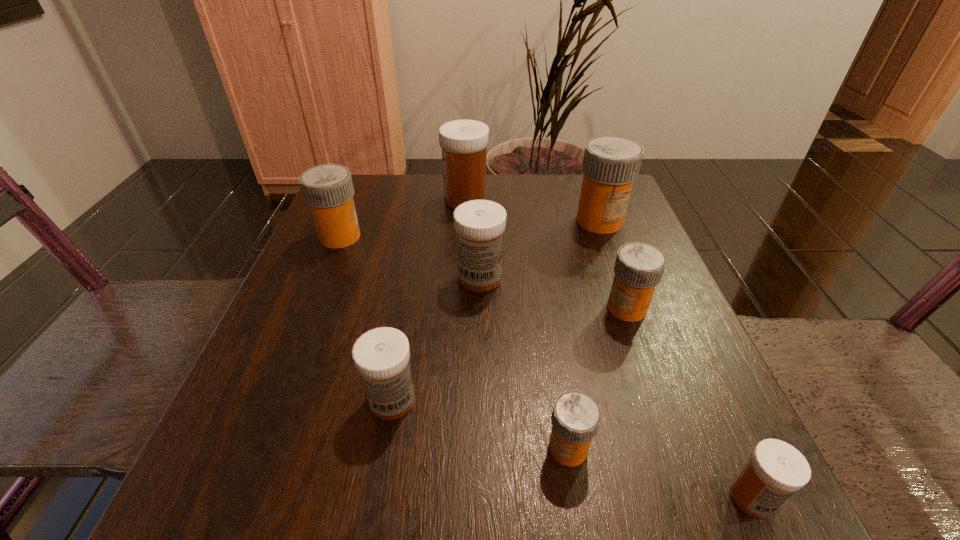
The image size is (960, 540). What are the coordinates of `vacant space that satisfies the following two spatial constraints: 1. on the front side of the second farthest white medicine; 2. on the left side of the nearest object` in the screenshot? It's located at (480, 497).